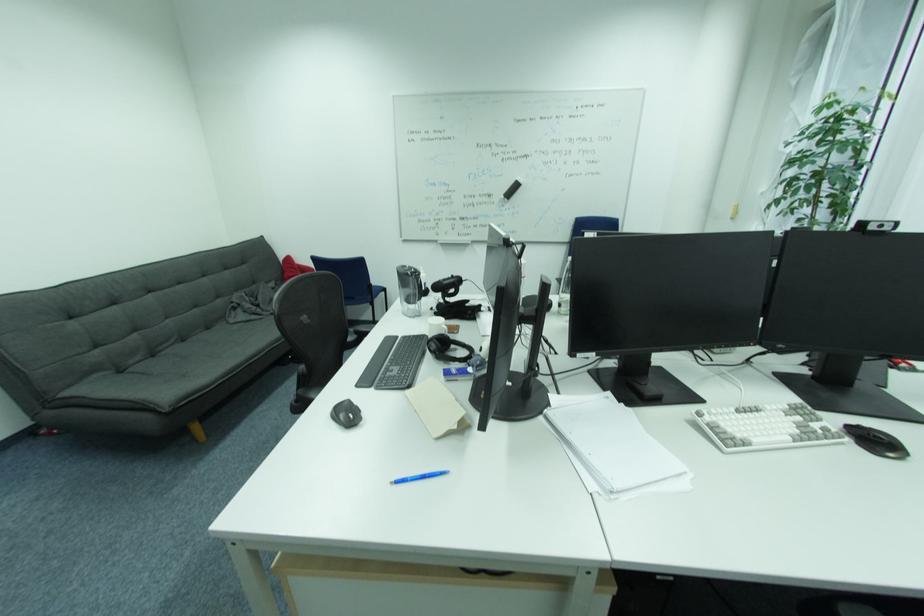
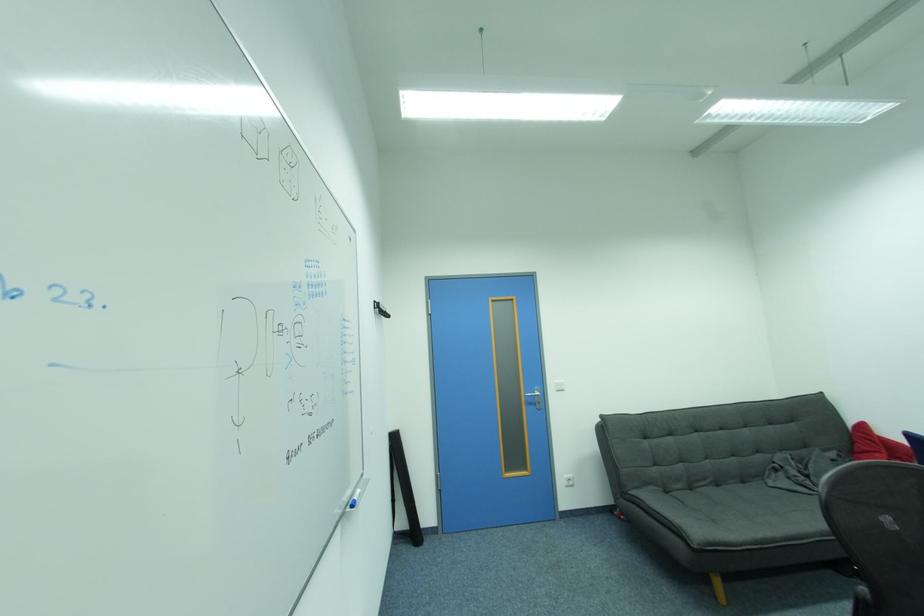
Locate, in the second image, the point that corresponds to point 190,342 in the first image.

(723, 487)